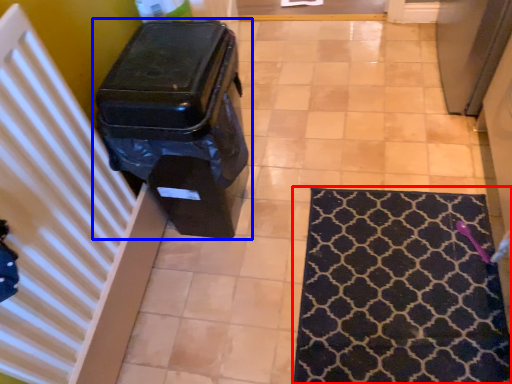
Question: Among these objects, which one is nearest to the camera, mat (highlighted by a red box) or waste container (highlighted by a blue box)?

Choices:
 (A) mat
 (B) waste container

Answer: (B)